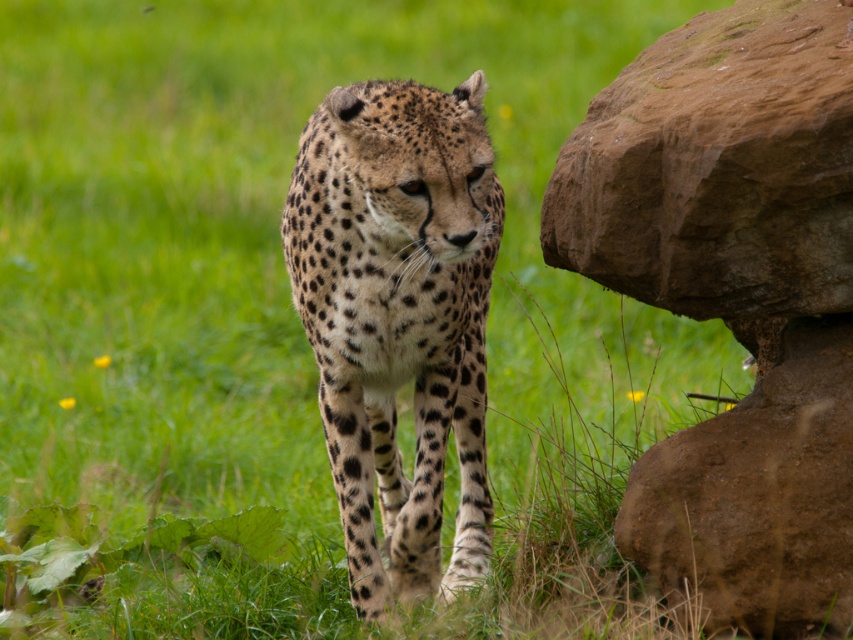
Question: Can you confirm if spotted fur cheetah at center is wider than brown rough rock at right?

Choices:
 (A) yes
 (B) no

Answer: (B)

Question: Among these objects, which one is farthest from the camera?

Choices:
 (A) brown rough rock at right
 (B) spotted fur cheetah at center

Answer: (A)

Question: Does spotted fur cheetah at center have a larger size compared to brown rough rock at right?

Choices:
 (A) no
 (B) yes

Answer: (B)

Question: Which point is farther to the camera?

Choices:
 (A) brown rough rock at right
 (B) spotted fur cheetah at center

Answer: (A)

Question: Is spotted fur cheetah at center positioned behind brown rough rock at right?

Choices:
 (A) yes
 (B) no

Answer: (B)

Question: Which point is farther from the camera taking this photo?

Choices:
 (A) (822, 168)
 (B) (381, 440)

Answer: (B)